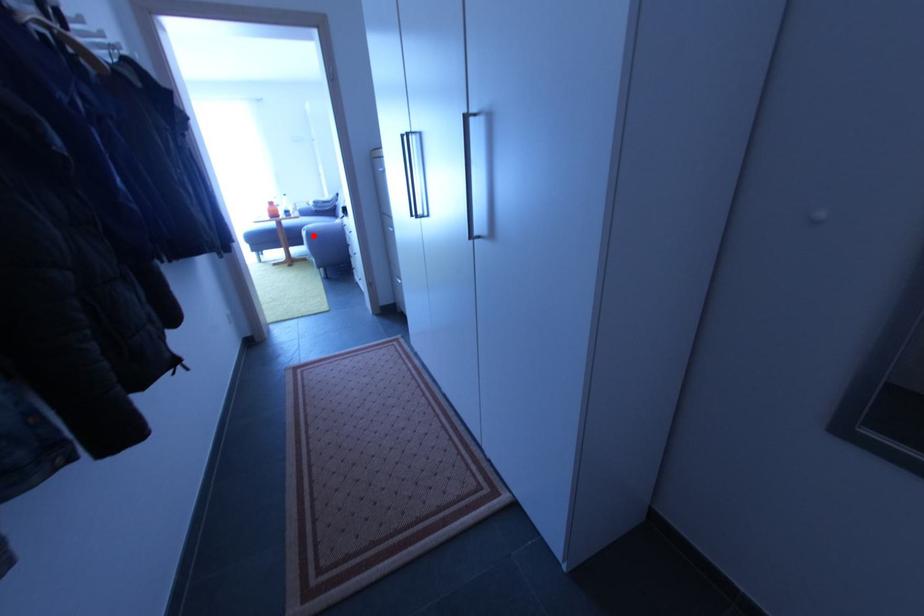
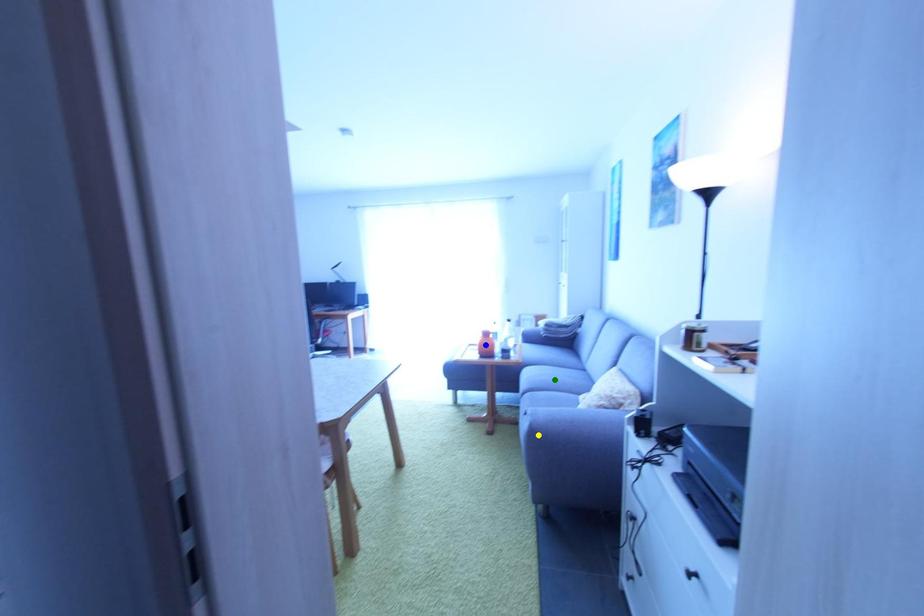
Question: I am providing you with two images of the same scene from different viewpoints. A red point is marked on the first image. You are given multiple points on the second image. Which mark in image 2 goes with the point in image 1?

Choices:
 (A) blue point
 (B) yellow point
 (C) green point

Answer: (B)